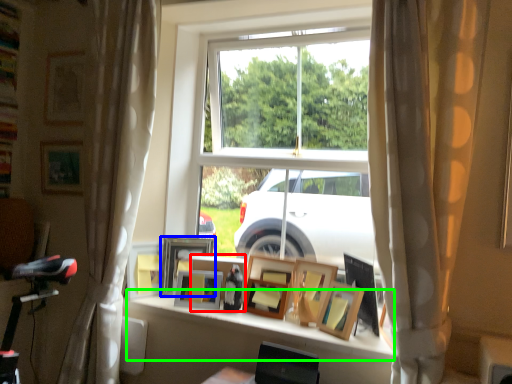
Question: Which is farther away from picture frame (highlighted by a red box)? picture frame (highlighted by a blue box) or window sill (highlighted by a green box)?

Choices:
 (A) picture frame
 (B) window sill

Answer: (B)